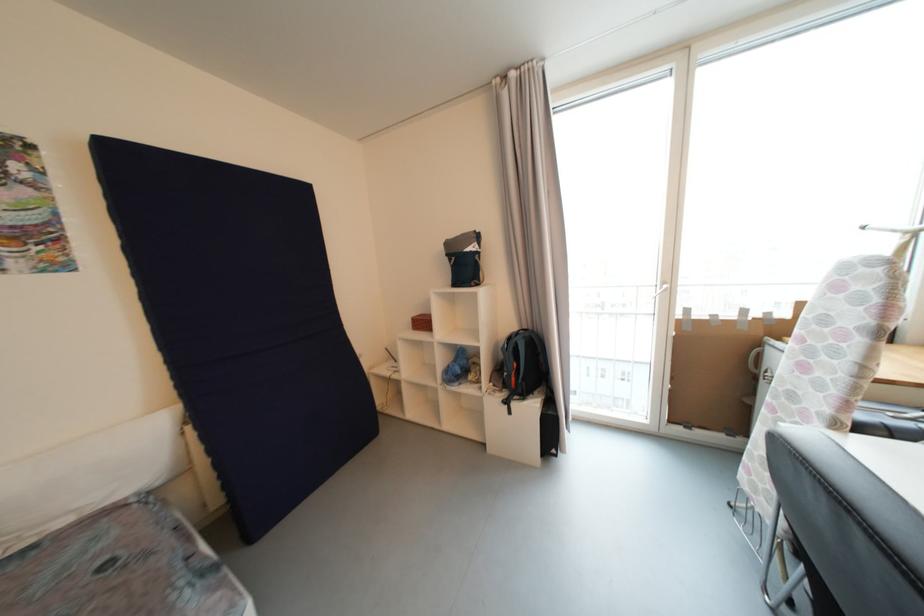
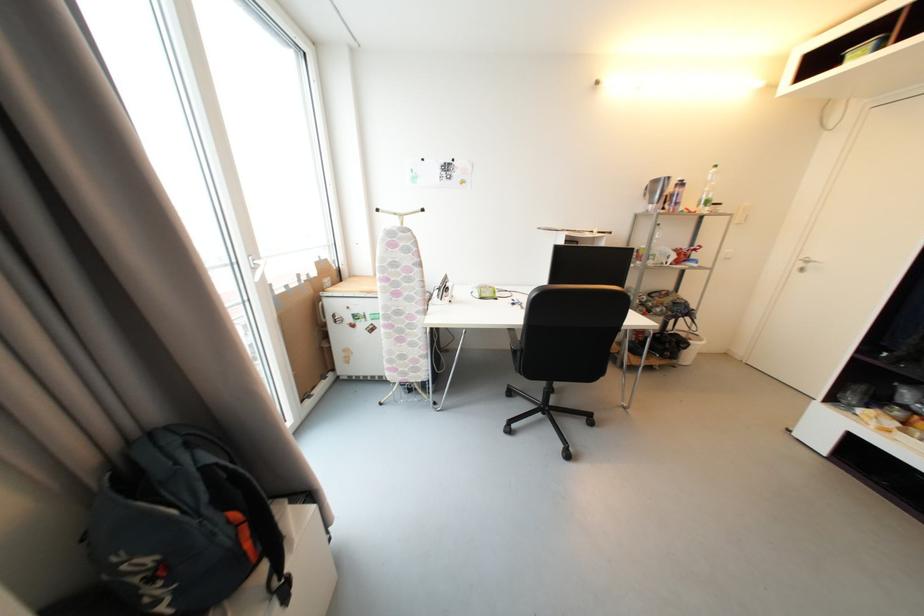
Locate, in the second image, the point that corresponds to [517,381] in the first image.

(253, 546)